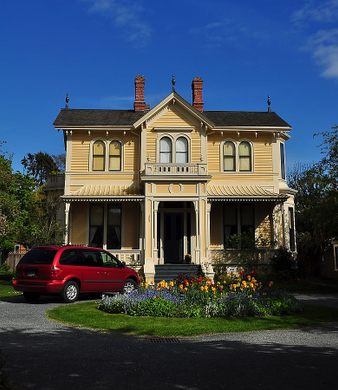
Image resolution: width=338 pixels, height=390 pixels. In order to click on window in this screenshot , I will do click(x=114, y=236).